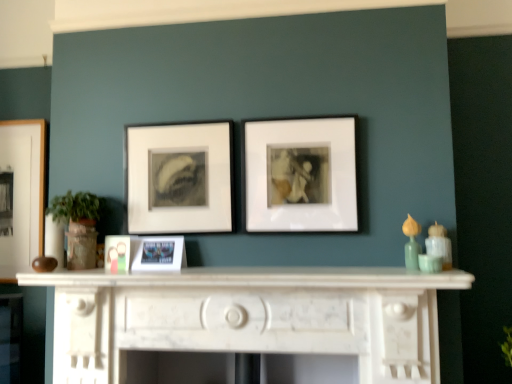
Find the location of `metallic silver photo frame at center, which is the 2th picture frame from front to back`. metallic silver photo frame at center, which is the 2th picture frame from front to back is located at coordinates (159, 254).

What are the coordinates of `matte plastic photo frame at center, acting as the 3th picture frame starting from the back` in the screenshot? It's located at (117, 253).

What do you see at coordinates (298, 175) in the screenshot? I see `white matte picture frame at center, the first picture frame in the front-to-back sequence` at bounding box center [298, 175].

Describe the element at coordinates (248, 317) in the screenshot. This screenshot has height=384, width=512. I see `white marble fireplace at center` at that location.

Identify the location of metallic silver photo frame at center, which is the 2th picture frame from front to back. The width and height of the screenshot is (512, 384). (159, 254).

Is white matte picture frame at center, the first picture frame in the front-to-back sequence, located within metallic silver photo frame at center, which appears as the 4th picture frame when viewed from the back?

No, white matte picture frame at center, the first picture frame in the front-to-back sequence, is not surrounded by metallic silver photo frame at center, which appears as the 4th picture frame when viewed from the back.

From a real-world perspective, is metallic silver photo frame at center, which is the 2th picture frame from front to back, located beneath white matte picture frame at center, which is the 5th picture frame in back-to-front order?

Yes, from a real-world perspective, metallic silver photo frame at center, which is the 2th picture frame from front to back, is beneath white matte picture frame at center, which is the 5th picture frame in back-to-front order.

From the image's perspective, would you say metallic silver photo frame at center, acting as the 3th picture frame starting from the right, is positioned over white matte picture frame at center, which is the 5th picture frame in back-to-front order?

No, from the image's perspective, metallic silver photo frame at center, acting as the 3th picture frame starting from the right, is not on top of white matte picture frame at center, which is the 5th picture frame in back-to-front order.

How distant is metallic silver photo frame at center, which appears as the 4th picture frame when viewed from the back, from white matte picture frame at center, the 5th picture frame from the left?

They are 22.53 inches apart.

Could you tell me if matte plastic photo frame at center, placed as the 2th picture frame when sorted from left to right, is facing teal ceramic vase at right?

No, matte plastic photo frame at center, placed as the 2th picture frame when sorted from left to right, is not turned towards teal ceramic vase at right.

Where is `the 2nd picture frame above the teal ceramic vase at right (from a real-world perspective)`? The image size is (512, 384). the 2nd picture frame above the teal ceramic vase at right (from a real-world perspective) is located at coordinates (117, 253).

Which object is thinner, matte plastic photo frame at center, placed as the 2th picture frame when sorted from left to right, or teal ceramic vase at right?

Thinner between the two is matte plastic photo frame at center, placed as the 2th picture frame when sorted from left to right.

From a real-world perspective, is matte plastic photo frame at center, which appears as the 4th picture frame when viewed from the right, physically below teal ceramic vase at right?

Actually, matte plastic photo frame at center, which appears as the 4th picture frame when viewed from the right, is physically above teal ceramic vase at right in the real world.

Is teal ceramic vase at right surrounding matte white frame at center, the 4th picture frame positioned from the front?

Actually, matte white frame at center, the 4th picture frame positioned from the front, is outside teal ceramic vase at right.

Is teal ceramic vase at right not close to matte white frame at center, the 4th picture frame positioned from the front?

teal ceramic vase at right is positioned a significant distance from matte white frame at center, the 4th picture frame positioned from the front.

From a real-world perspective, is teal ceramic vase at right positioned above or below matte white frame at center, the 4th picture frame positioned from the front?

teal ceramic vase at right is below matte white frame at center, the 4th picture frame positioned from the front.

Can you confirm if matte white frame at center, arranged as the second picture frame when viewed from the right, is positioned to the right of teal ceramic vase at right?

In fact, matte white frame at center, arranged as the second picture frame when viewed from the right, is to the left of teal ceramic vase at right.

From a real-world perspective, which is physically below, matte white frame at center, the 4th picture frame positioned from the front, or teal ceramic vase at right?

In real-world perspective, teal ceramic vase at right is lower.

Does matte white frame at center, the 4th picture frame positioned from the front, touch teal ceramic vase at right?

No, matte white frame at center, the 4th picture frame positioned from the front, is not next to teal ceramic vase at right.

Between matte white frame at center, which is the second picture frame in back-to-front order, and metallic silver photo frame at center, which is the 2th picture frame from front to back, which one has larger size?

With larger size is matte white frame at center, which is the second picture frame in back-to-front order.

Is matte white frame at center, the 4th picture frame when ordered from left to right, outside of metallic silver photo frame at center, which is the 2th picture frame from front to back?

matte white frame at center, the 4th picture frame when ordered from left to right, lies outside metallic silver photo frame at center, which is the 2th picture frame from front to back,'s area.

Is matte white frame at center, arranged as the second picture frame when viewed from the right, facing away from metallic silver photo frame at center, which appears as the 4th picture frame when viewed from the back?

matte white frame at center, arranged as the second picture frame when viewed from the right, is not turned away from metallic silver photo frame at center, which appears as the 4th picture frame when viewed from the back.

Is matte white frame at center, arranged as the second picture frame when viewed from the right, far away from metallic silver photo frame at center, the 3th picture frame positioned from the left?

matte white frame at center, arranged as the second picture frame when viewed from the right, is actually quite close to metallic silver photo frame at center, the 3th picture frame positioned from the left.

Is the depth of matte white frame at center, arranged as the second picture frame when viewed from the right, less than that of matte plastic photo frame at center, marked as the third picture frame in a front-to-back arrangement?

No, matte white frame at center, arranged as the second picture frame when viewed from the right, is behind matte plastic photo frame at center, marked as the third picture frame in a front-to-back arrangement.

Which is more to the left, matte white frame at center, the 4th picture frame when ordered from left to right, or matte plastic photo frame at center, which appears as the 4th picture frame when viewed from the right?

From the viewer's perspective, matte plastic photo frame at center, which appears as the 4th picture frame when viewed from the right, appears more on the left side.

Between matte white frame at center, which is the second picture frame in back-to-front order, and matte plastic photo frame at center, which appears as the 4th picture frame when viewed from the right, which one has smaller size?

matte plastic photo frame at center, which appears as the 4th picture frame when viewed from the right.

Would you say matte plastic photo frame at center, acting as the 3th picture frame starting from the back, is part of matte white frame at center, the 4th picture frame when ordered from left to right,'s contents?

Definitely not — matte plastic photo frame at center, acting as the 3th picture frame starting from the back, is not inside matte white frame at center, the 4th picture frame when ordered from left to right.

Based on the photo, is matte white frame at center, the 4th picture frame when ordered from left to right, at the back of white matte picture frame at center, which is the 5th picture frame in back-to-front order?

That's not correct — white matte picture frame at center, which is the 5th picture frame in back-to-front order, is not looking away from matte white frame at center, the 4th picture frame when ordered from left to right.

Who is more distant, white matte picture frame at center, the first picture frame in the front-to-back sequence, or matte white frame at center, the 4th picture frame when ordered from left to right?

matte white frame at center, the 4th picture frame when ordered from left to right, is further from the camera.

Is white matte picture frame at center, which is the 5th picture frame in back-to-front order, not close to matte white frame at center, the 4th picture frame when ordered from left to right?

They are positioned close to each other.

From the image's perspective, is white matte picture frame at center, the first picture frame in the front-to-back sequence, above or below matte white frame at center, the 4th picture frame when ordered from left to right?

Based on their image positions, white matte picture frame at center, the first picture frame in the front-to-back sequence, is located above matte white frame at center, the 4th picture frame when ordered from left to right.

Identify the location of the 2nd picture frame to the right of the metallic silver photo frame at center, acting as the 3th picture frame starting from the right, counting from the anchor's position. (298, 175).

Which picture frame is the 3rd one when counting from the back of the teal ceramic vase at right? Please provide its 2D coordinates.

[(117, 253)]

From the image, which object appears to be farther from teal ceramic vase at right, metallic silver photo frame at center, which is the 2th picture frame from front to back, or matte white frame at center, the 4th picture frame positioned from the front?

The object further to teal ceramic vase at right is metallic silver photo frame at center, which is the 2th picture frame from front to back.

Estimate the real-world distances between objects in this image. Which object is further from wooden picture frame at left, the fifth picture frame positioned from the front, matte plastic photo frame at center, marked as the third picture frame in a front-to-back arrangement, or metallic silver photo frame at center, which appears as the 4th picture frame when viewed from the back?

The object further to wooden picture frame at left, the fifth picture frame positioned from the front, is metallic silver photo frame at center, which appears as the 4th picture frame when viewed from the back.

Looking at the image, which one is located further to teal ceramic vase at right, matte white frame at center, the 4th picture frame when ordered from left to right, or wooden picture frame at left, the 5th picture frame when ordered from right to left?

Based on the image, wooden picture frame at left, the 5th picture frame when ordered from right to left, appears to be further to teal ceramic vase at right.

Looking at the image, which one is located further to matte plastic photo frame at center, marked as the third picture frame in a front-to-back arrangement, white matte picture frame at center, the 5th picture frame from the left, or white marble fireplace at center?

white matte picture frame at center, the 5th picture frame from the left, is further to matte plastic photo frame at center, marked as the third picture frame in a front-to-back arrangement.

Looking at the image, which one is located further to matte white frame at center, arranged as the second picture frame when viewed from the right, metallic silver photo frame at center, the 3th picture frame positioned from the left, or matte plastic photo frame at center, acting as the 3th picture frame starting from the back?

Among the two, matte plastic photo frame at center, acting as the 3th picture frame starting from the back, is located further to matte white frame at center, arranged as the second picture frame when viewed from the right.

Based on their spatial positions, is metallic silver photo frame at center, which is the 2th picture frame from front to back, or white marble fireplace at center further from wooden picture frame at left, positioned as the 1th picture frame in back-to-front order?

Based on the image, white marble fireplace at center appears to be further to wooden picture frame at left, positioned as the 1th picture frame in back-to-front order.

When comparing their distances from wooden picture frame at left, the 5th picture frame when ordered from right to left, does metallic silver photo frame at center, which appears as the 4th picture frame when viewed from the back, or matte plastic photo frame at center, acting as the 3th picture frame starting from the back, seem further?

metallic silver photo frame at center, which appears as the 4th picture frame when viewed from the back, lies further to wooden picture frame at left, the 5th picture frame when ordered from right to left, than the other object.

Based on their spatial positions, is matte plastic photo frame at center, acting as the 3th picture frame starting from the back, or white matte picture frame at center, the 5th picture frame from the left, closer to white marble fireplace at center?

white matte picture frame at center, the 5th picture frame from the left, lies closer to white marble fireplace at center than the other object.

I want to click on picture frame between matte white frame at center, which is the second picture frame in back-to-front order, and teal ceramic vase at right from left to right, so click(x=298, y=175).

In order to click on table between wooden picture frame at left, positioned as the 1th picture frame in back-to-front order, and white matte picture frame at center, which is the 5th picture frame in back-to-front order, in the horizontal direction in this screenshot , I will do `click(248, 317)`.

You are a GUI agent. You are given a task and a screenshot of the screen. Output one action in this format:
    pyautogui.click(x=<x>, y=<y>)
    Task: Click on the table situated between wooden picture frame at left, positioned as the 1th picture frame in back-to-front order, and teal ceramic vase at right from left to right
    Image resolution: width=512 pixels, height=384 pixels.
    Given the screenshot: What is the action you would take?
    (248, 317)

In order to click on picture frame situated between metallic silver photo frame at center, the 3th picture frame positioned from the left, and white matte picture frame at center, marked as the 1th picture frame in a right-to-left arrangement, from left to right in this screenshot , I will do `click(179, 177)`.